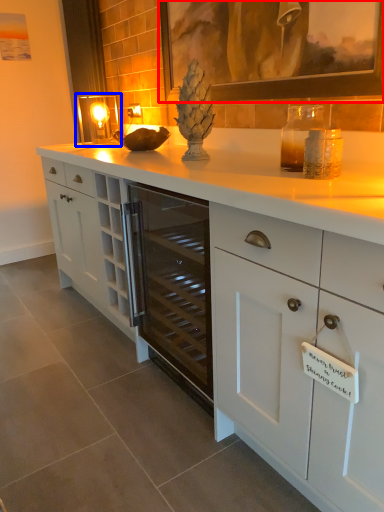
Question: Which of the following is the closest to the observer, picture frame (highlighted by a red box) or candle holder (highlighted by a blue box)?

Choices:
 (A) picture frame
 (B) candle holder

Answer: (A)